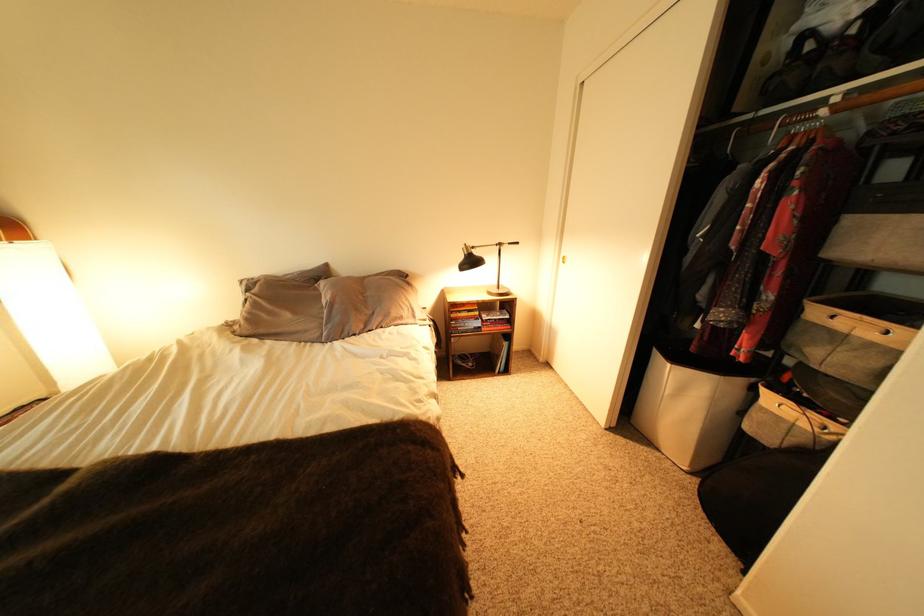
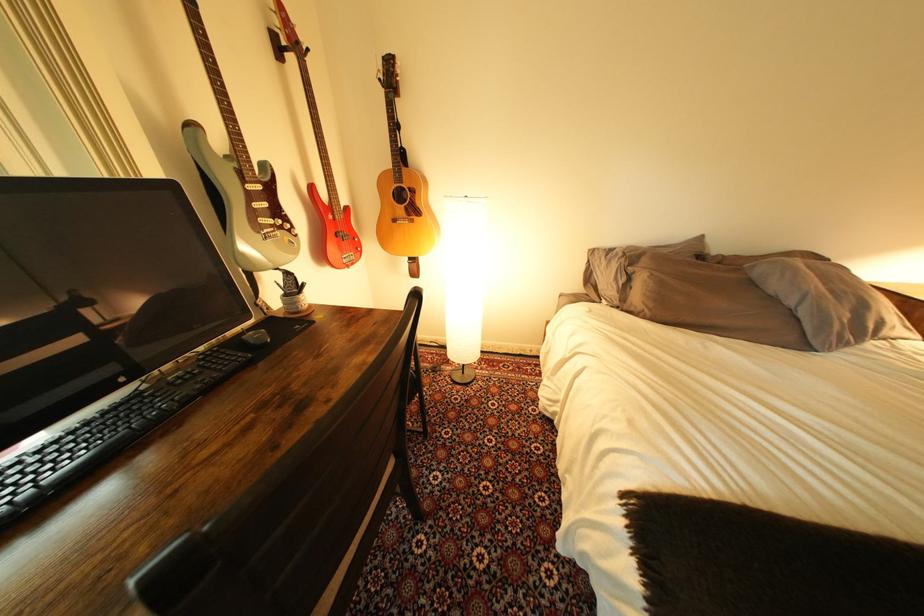
In the second image, find the point that corresponds to pixel 254 284 in the first image.

(604, 253)